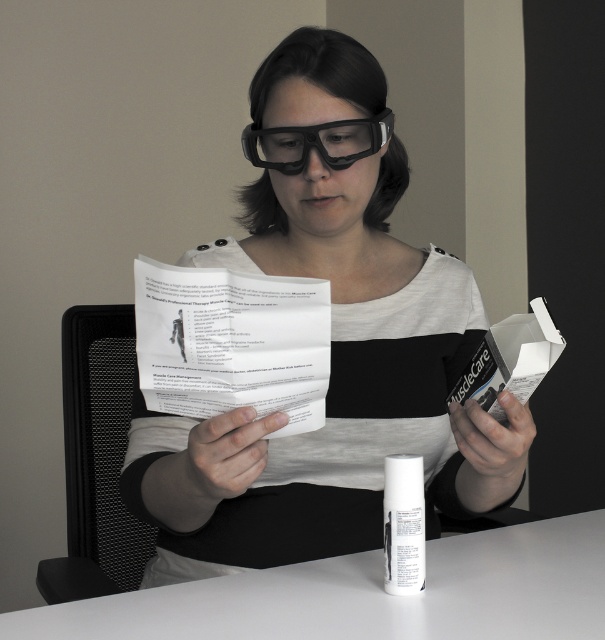
Question: Which of the following is the closest to the observer?

Choices:
 (A) matte black glasses at upper center
 (B) transparent plastic glasses at center
 (C) white matte table at center

Answer: (C)

Question: Which point is closer to the camera?

Choices:
 (A) matte black glasses at upper center
 (B) transparent plastic glasses at center
 (C) white matte table at center

Answer: (C)

Question: Is matte black glasses at upper center below transparent plastic glasses at center?

Choices:
 (A) no
 (B) yes

Answer: (B)

Question: Does matte black glasses at upper center appear on the left side of white matte table at center?

Choices:
 (A) no
 (B) yes

Answer: (B)

Question: Is the position of matte black glasses at upper center less distant than that of transparent plastic glasses at center?

Choices:
 (A) yes
 (B) no

Answer: (A)

Question: Which object is positioned closest to the white matte table at center?

Choices:
 (A) matte black glasses at upper center
 (B) transparent plastic glasses at center

Answer: (A)